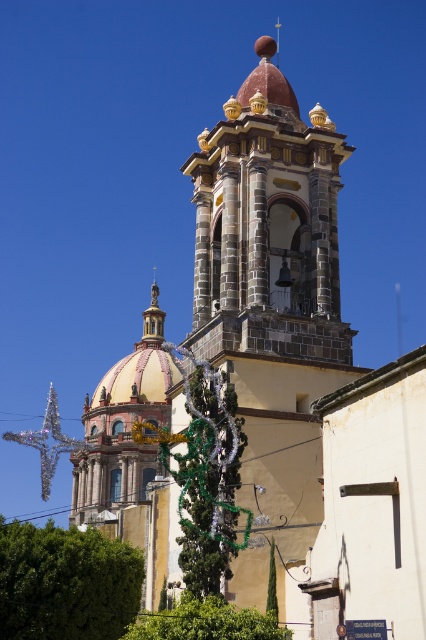
You are standing in front of the cathedral and notice a green leafy tree at lower left and a green metallic garland at center. Which object is closer to the ground?

The green leafy tree at lower left is closer to the ground because it is positioned under the green metallic garland at center.

You are a gardener standing near the green leafy tree at lower left and want to reach the green metallic garland at center to decorate it. Can you walk directly to it without crossing any obstacles?

The distance between the green leafy tree at lower left and the green metallic garland at center is 6.85 meters. Since there are no obstacles mentioned in the scene, you can walk directly to it.